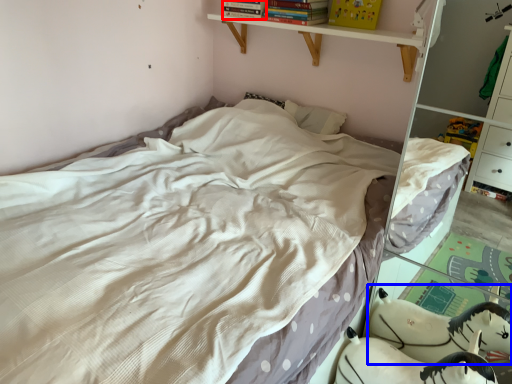
Question: Which object is further to the camera taking this photo, book (highlighted by a red box) or animal (highlighted by a blue box)?

Choices:
 (A) book
 (B) animal

Answer: (A)